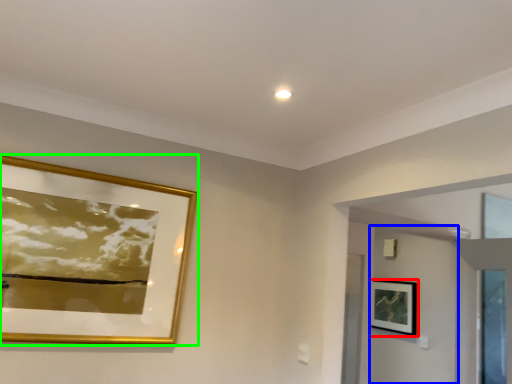
Question: Considering the real-world distances, which object is closest to picture frame (highlighted by a red box)? door (highlighted by a blue box) or picture frame (highlighted by a green box).

Choices:
 (A) door
 (B) picture frame

Answer: (A)